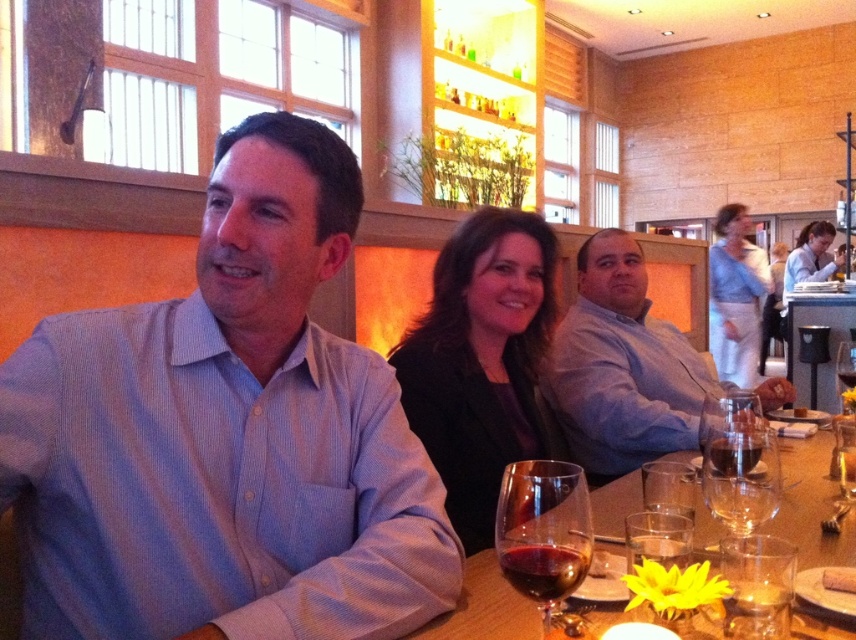
Question: Which of the following is the farthest from the observer?

Choices:
 (A) translucent glass wine at center
 (B) clear glass wine glass at table right

Answer: (B)

Question: Can you confirm if light blue striped shirt at left is thinner than dark red glass at lower center?

Choices:
 (A) yes
 (B) no

Answer: (B)

Question: Can you confirm if translucent glass wine at center is wider than dark red glass at lower center?

Choices:
 (A) yes
 (B) no

Answer: (A)

Question: Does clear glass table at center lie in front of dark red glass at lower center?

Choices:
 (A) no
 (B) yes

Answer: (A)

Question: Which object is farther from the camera taking this photo?

Choices:
 (A) translucent glass at table right
 (B) matte black jacket at center

Answer: (A)

Question: Estimate the real-world distances between objects in this image. Which object is closer to the dark red glass at lower center?

Choices:
 (A) dark glass at table right
 (B) clear glass wine glass at table right
 (C) light blue striped shirt at left

Answer: (B)